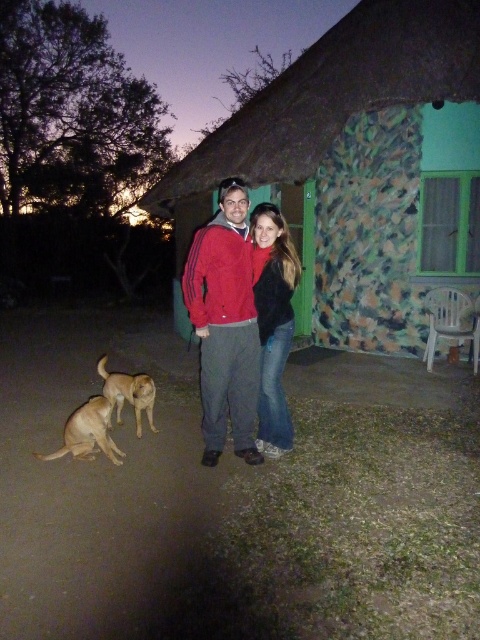
You are a photographer trying to frame a shot of the two people wearing the red matte jacket at center and the matte black jacket at center. Since you want both jackets to appear the same size in the photo, which direction should you move your camera?

To make the red matte jacket at center and the matte black jacket at center appear the same size in the photo, you should move the camera away from the red matte jacket at center because it is larger in size than the matte black jacket at center.

You are a photographer trying to capture both the camouflage stucco hut at center and the golden fur dog at lower left in a single shot. Based on their positions, which object will appear larger in the photo?

The camouflage stucco hut at center will appear larger in the photo because it is closer to the viewer than the golden fur dog at lower left.

You are a photographer trying to capture a group photo of the red matte jacket at center and the brown furry dog at lower left. Since you want to ensure both subjects are clearly visible, which one should you focus on first to account for their size difference?

The red matte jacket at center is larger in size than the brown furry dog at lower left, so you should focus on the red matte jacket at center first as it occupies more space in the frame and requires proper focus to capture details effectively.